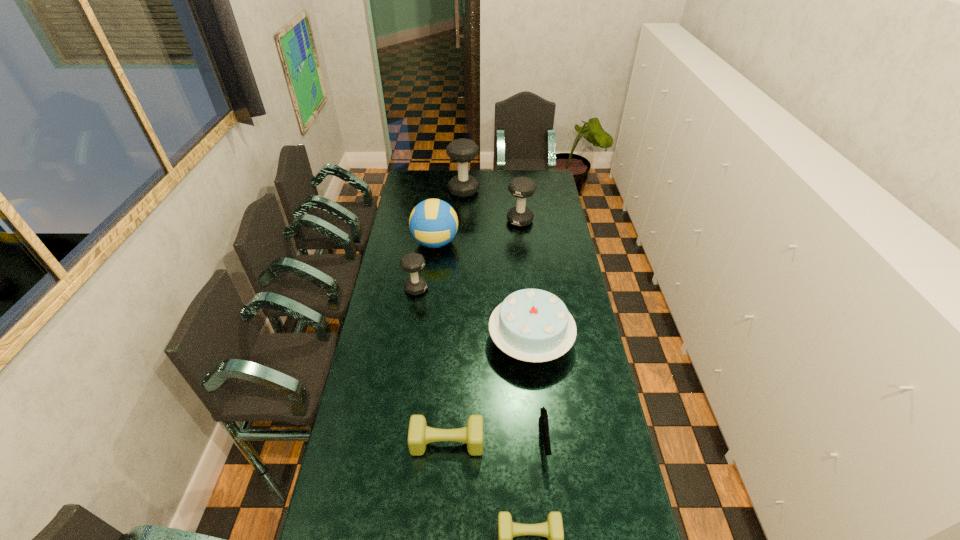
Identify the location of the fourth farthest dumbbell. The width and height of the screenshot is (960, 540). (419, 434).

You are a GUI agent. You are given a task and a screenshot of the screen. Output one action in this format:
    pyautogui.click(x=<x>, y=<y>)
    Task: Click on the black pistol
    The width and height of the screenshot is (960, 540).
    Given the screenshot: What is the action you would take?
    pyautogui.click(x=543, y=419)

Image resolution: width=960 pixels, height=540 pixels. In order to click on free region located 0.110m on the front of the tallest dumbbell in this screenshot , I will do `click(463, 211)`.

Where is `free spot located 0.360m on the right of the blue volleyball`? free spot located 0.360m on the right of the blue volleyball is located at coordinates (529, 242).

You are a GUI agent. You are given a task and a screenshot of the screen. Output one action in this format:
    pyautogui.click(x=<x>, y=<y>)
    Task: Click on the vacant space located on the back of the rightmost gray dumbbell
    
    Given the screenshot: What is the action you would take?
    pyautogui.click(x=516, y=186)

I want to click on free location located on the back of the birthday cake, so click(x=522, y=266).

Locate an element on the screen. vacant point located 0.200m on the right of the fourth farthest object is located at coordinates (471, 289).

I want to click on vacant space located on the back of the left olive dumbbell, so click(x=450, y=393).

I want to click on free region located 0.050m on the front-facing side of the black pistol, so click(548, 482).

Find the location of a particular element. The width and height of the screenshot is (960, 540). object present at the far edge is located at coordinates (462, 150).